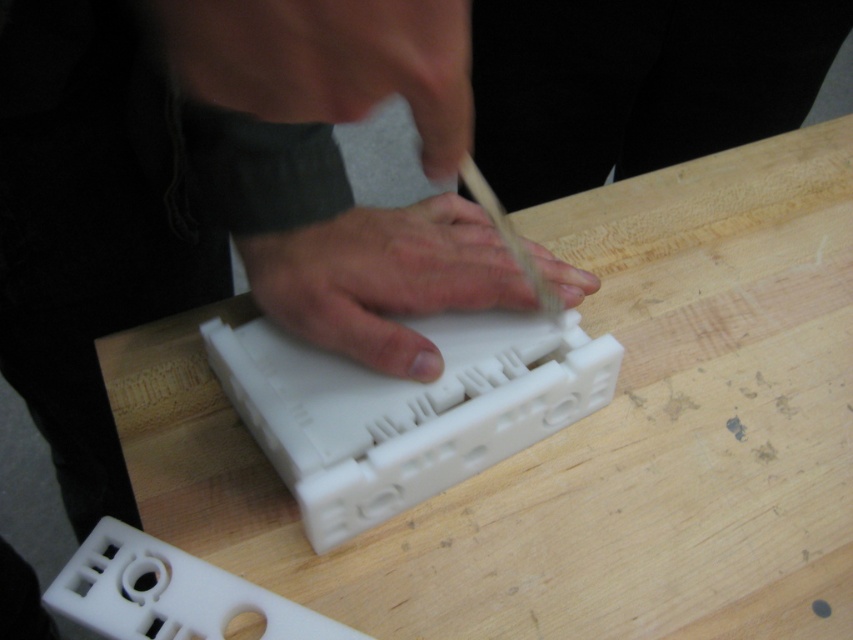
Which of these two, matte black hand at upper center or wooden stick at center, stands shorter?

matte black hand at upper center

Is matte black hand at upper center below wooden stick at center?

Incorrect, matte black hand at upper center is not positioned below wooden stick at center.

Between point (158, 8) and point (560, 317), which one is positioned in front?

Point (158, 8) is in front.

At what (x,y) coordinates should I click in order to perform the action: click on matte black hand at upper center. Please return your answer as a coordinate pair (x, y). The width and height of the screenshot is (853, 640). Looking at the image, I should click on (328, 61).

Which is above, white matte wood at center or white matte plastic object at center?

white matte wood at center is higher up.

Is the position of white matte wood at center more distant than that of white matte plastic object at center?

Yes.

Locate an element on the screen. The height and width of the screenshot is (640, 853). white matte wood at center is located at coordinates (585, 435).

You are a GUI agent. You are given a task and a screenshot of the screen. Output one action in this format:
    pyautogui.click(x=<x>, y=<y>)
    Task: Click on the white matte wood at center
    
    Given the screenshot: What is the action you would take?
    pyautogui.click(x=585, y=435)

Is white matte wood at center further to camera compared to wooden stick at center?

Yes, white matte wood at center is further from the viewer.

Between point (795, 417) and point (500, 216), which one is positioned behind?

Positioned behind is point (795, 417).

Locate an element on the screen. The image size is (853, 640). white matte wood at center is located at coordinates (585, 435).